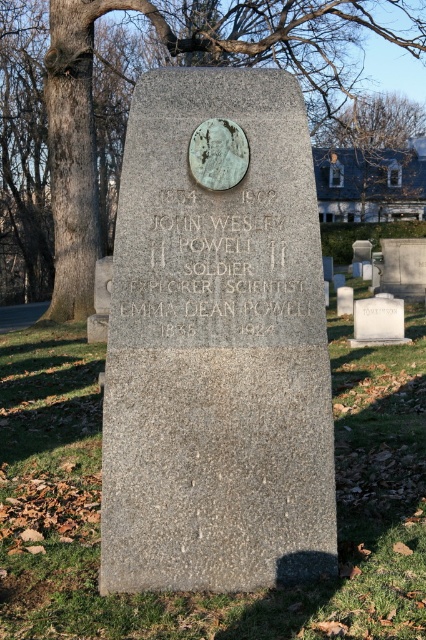
Who is positioned more to the left, granite gravestone at center or bare branches at upper center?

From the viewer's perspective, granite gravestone at center appears more on the left side.

Who is taller, granite gravestone at center or bare branches at upper center?

bare branches at upper center is taller.

Does point (175, 508) come farther from viewer compared to point (316, 172)?

No.

The height and width of the screenshot is (640, 426). I want to click on granite gravestone at center, so click(x=216, y=342).

What do you see at coordinates (176, 61) in the screenshot?
I see `brown bark tree at upper left` at bounding box center [176, 61].

Is point (236, 48) positioned after point (331, 202)?

No, (236, 48) is closer to viewer.

Is point (46, 284) positioned in front of point (403, 138)?

Yes.

At what (x,y) coordinates should I click in order to perform the action: click on brown bark tree at upper left. Please return your answer as a coordinate pair (x, y). Looking at the image, I should click on (176, 61).

Who is shorter, bronze plaque at center or white marble gravestone at center?

With less height is white marble gravestone at center.

Is bronze plaque at center behind white marble gravestone at center?

No, bronze plaque at center is in front of white marble gravestone at center.

Does point (121, 314) come closer to viewer compared to point (397, 310)?

Yes, point (121, 314) is in front of point (397, 310).

This screenshot has height=640, width=426. In order to click on bronze plaque at center in this screenshot , I will do `click(215, 268)`.